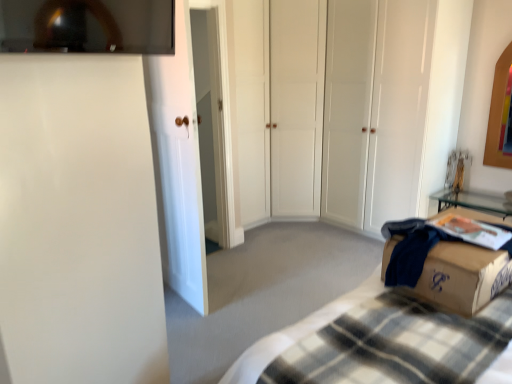
Question: Could you tell me if plaid fabric bed at lower right is turned towards brown cardboard box at lower right?

Choices:
 (A) no
 (B) yes

Answer: (A)

Question: From a real-world perspective, does plaid fabric bed at lower right sit lower than brown cardboard box at lower right?

Choices:
 (A) no
 (B) yes

Answer: (B)

Question: Is the position of plaid fabric bed at lower right less distant than that of brown cardboard box at lower right?

Choices:
 (A) no
 (B) yes

Answer: (B)

Question: Is the depth of plaid fabric bed at lower right greater than that of brown cardboard box at lower right?

Choices:
 (A) yes
 (B) no

Answer: (B)

Question: From the image's perspective, is plaid fabric bed at lower right beneath brown cardboard box at lower right?

Choices:
 (A) yes
 (B) no

Answer: (A)

Question: Is plaid fabric bed at lower right bigger or smaller than white matte closet doors at center, which appears as the first glass door when viewed from the right?

Choices:
 (A) small
 (B) big

Answer: (A)

Question: From a real-world perspective, is plaid fabric bed at lower right physically located above or below white matte closet doors at center, which appears as the first glass door when viewed from the right?

Choices:
 (A) above
 (B) below

Answer: (B)

Question: Is plaid fabric bed at lower right situated inside white matte closet doors at center, which appears as the first glass door when viewed from the right, or outside?

Choices:
 (A) inside
 (B) outside

Answer: (B)

Question: Considering the positions of point (320, 355) and point (435, 8), is point (320, 355) closer or farther from the camera than point (435, 8)?

Choices:
 (A) farther
 (B) closer

Answer: (B)

Question: Considering their positions, is brown cardboard box at lower right located in front of or behind white glossy door at left, which ranks as the 1th glass door in left-to-right order?

Choices:
 (A) front
 (B) behind

Answer: (A)

Question: From the image's perspective, is brown cardboard box at lower right positioned above or below white glossy door at left, which is the 2th glass door from right to left?

Choices:
 (A) below
 (B) above

Answer: (A)

Question: Considering the positions of point pyautogui.click(x=471, y=264) and point pyautogui.click(x=164, y=64), is point pyautogui.click(x=471, y=264) closer or farther from the camera than point pyautogui.click(x=164, y=64)?

Choices:
 (A) farther
 (B) closer

Answer: (B)

Question: Is brown cardboard box at lower right bigger or smaller than white glossy door at left, the second glass door positioned from the back?

Choices:
 (A) small
 (B) big

Answer: (A)

Question: Considering the positions of white matte closet doors at center, which is the second glass door in front-to-back order, and plaid fabric bed at lower right in the image, is white matte closet doors at center, which is the second glass door in front-to-back order, bigger or smaller than plaid fabric bed at lower right?

Choices:
 (A) small
 (B) big

Answer: (B)

Question: In terms of width, does white matte closet doors at center, which is the 2th glass door from left to right, look wider or thinner when compared to plaid fabric bed at lower right?

Choices:
 (A) wide
 (B) thin

Answer: (A)